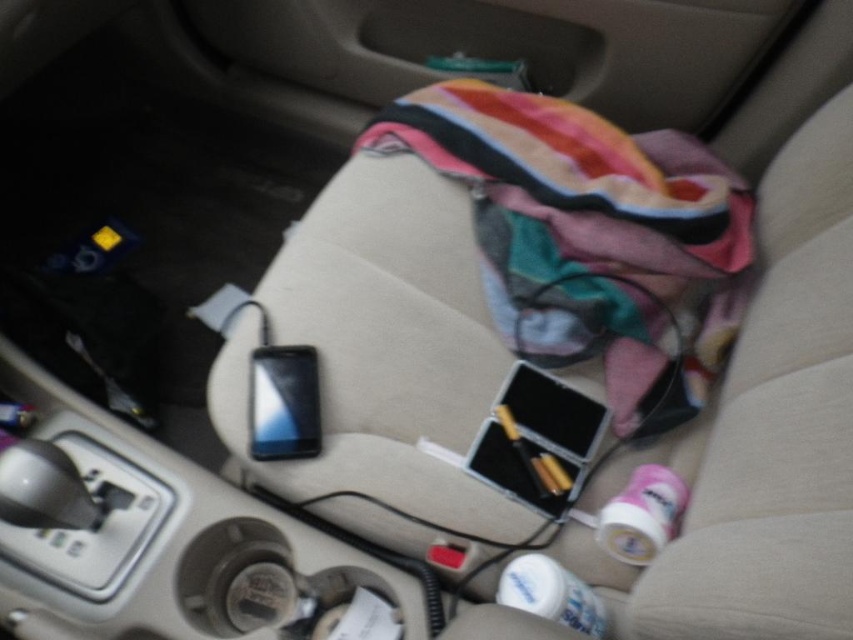
Question: Is striped cotton blanket at center smaller than satin black phone at center?

Choices:
 (A) yes
 (B) no

Answer: (B)

Question: Can you confirm if striped cotton blanket at center is positioned to the left of satin black phone at center?

Choices:
 (A) yes
 (B) no

Answer: (B)

Question: Among these objects, which one is nearest to the camera?

Choices:
 (A) satin black phone at center
 (B) striped cotton blanket at center

Answer: (A)

Question: Which point is farther to the camera?

Choices:
 (A) (561, 163)
 (B) (280, 397)

Answer: (A)

Question: Is striped cotton blanket at center thinner than satin black phone at center?

Choices:
 (A) no
 (B) yes

Answer: (A)